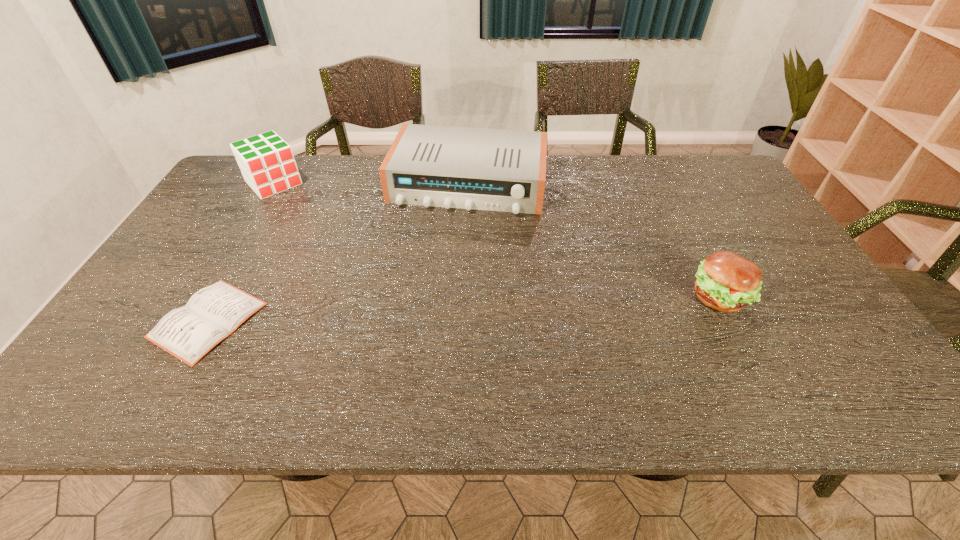
Where is `vacant spot on the desktop that is between the diary and the hamburger and is positioned on the control panel of the radio receiver`? vacant spot on the desktop that is between the diary and the hamburger and is positioned on the control panel of the radio receiver is located at coordinates (436, 310).

Find the location of a particular element. The image size is (960, 540). vacant space on the desktop that is between the shortest object and the hamburger and is positioned on the red face of the cube is located at coordinates (396, 312).